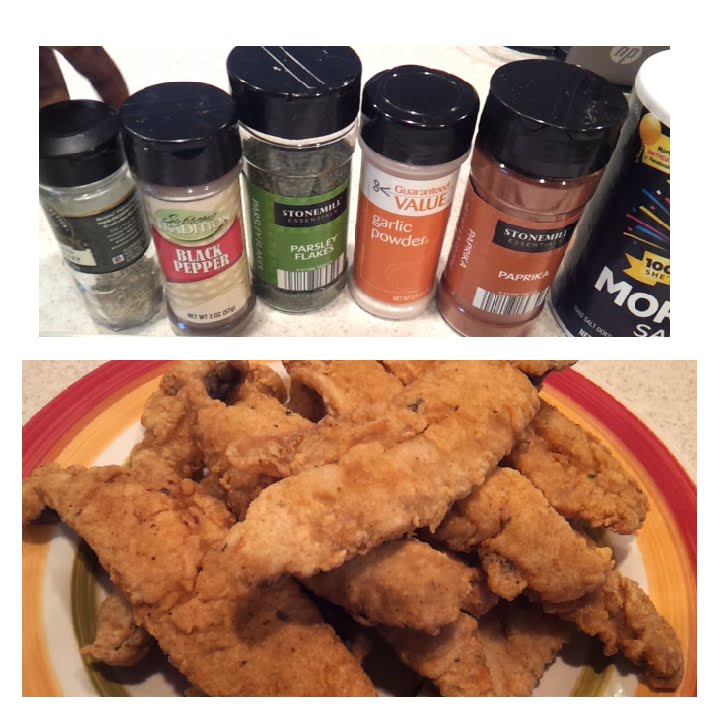
Locate an element on the screen. photo of spice containers is located at coordinates (346, 247).